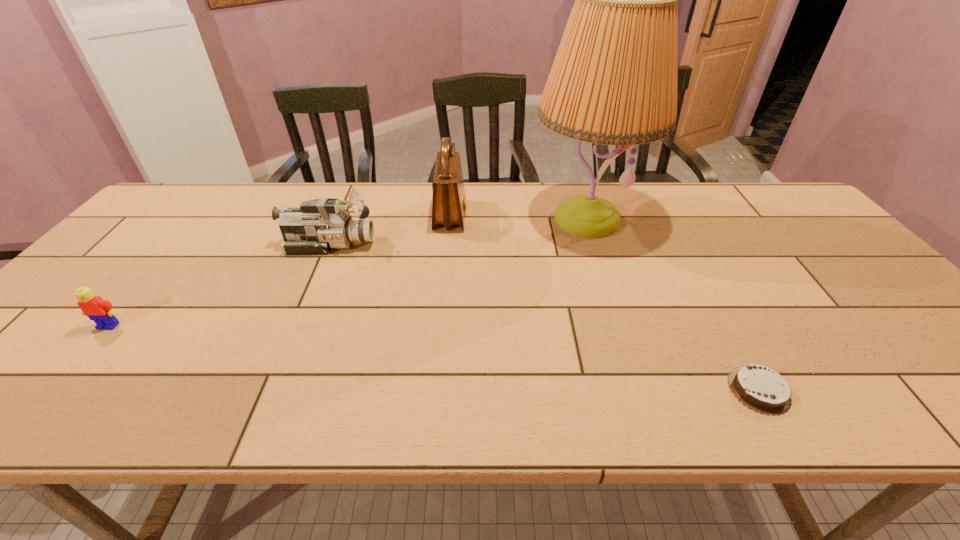
In order to click on vacant space that satisfies the following two spatial constraints: 1. on the front-facing side of the second object from left to right; 2. on the front-facing side of the Lego in this screenshot , I will do `click(295, 326)`.

Where is `vacant position in the image that satisfies the following two spatial constraints: 1. on the front-facing side of the camcorder; 2. on the front-facing side of the leftmost object`? vacant position in the image that satisfies the following two spatial constraints: 1. on the front-facing side of the camcorder; 2. on the front-facing side of the leftmost object is located at coordinates (295, 326).

In order to click on free space that satisfies the following two spatial constraints: 1. on the front-facing side of the third tallest object; 2. on the right side of the nearest object in this screenshot , I will do `click(267, 390)`.